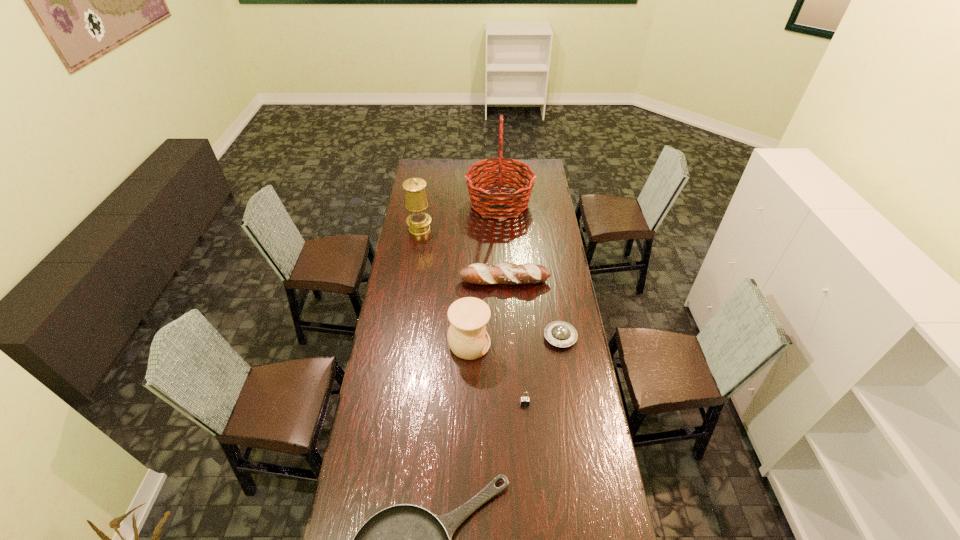
This screenshot has height=540, width=960. I want to click on vacant region located on the front of the third farthest object, so click(x=508, y=340).

This screenshot has height=540, width=960. In order to click on vacant space located 0.360m on the shackle of the padlock in this screenshot , I will do `click(533, 509)`.

Where is `free region located 0.310m on the back of the saucer`? The image size is (960, 540). free region located 0.310m on the back of the saucer is located at coordinates (550, 275).

This screenshot has height=540, width=960. Identify the location of object that is at the left edge. (418, 221).

Locate an element on the screen. The image size is (960, 540). basket at the right edge is located at coordinates (499, 203).

This screenshot has height=540, width=960. I want to click on baguet present at the right edge, so click(x=507, y=273).

Image resolution: width=960 pixels, height=540 pixels. In order to click on saucer that is at the right edge in this screenshot , I will do `click(559, 333)`.

Locate an element on the screen. The width and height of the screenshot is (960, 540). vacant space at the far edge of the desktop is located at coordinates (451, 166).

Locate an element on the screen. The height and width of the screenshot is (540, 960). free space at the left edge is located at coordinates (412, 237).

You are a GUI agent. You are given a task and a screenshot of the screen. Output one action in this format:
    pyautogui.click(x=<x>, y=<y>)
    Task: Click on the vacant space at the right edge of the desktop
    This screenshot has width=960, height=540.
    Given the screenshot: What is the action you would take?
    pyautogui.click(x=537, y=220)